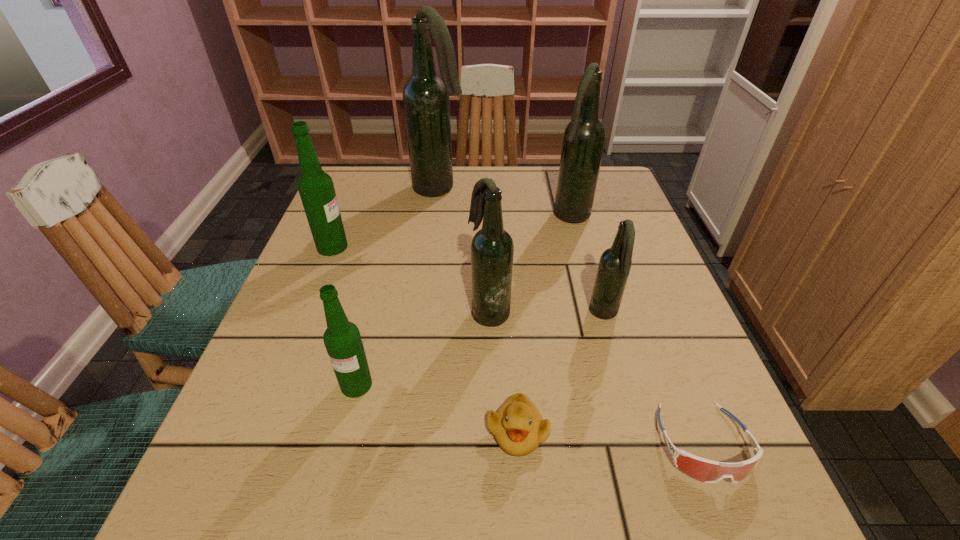
The image size is (960, 540). What are the coordinates of `the tallest beer bottle` in the screenshot? It's located at (426, 102).

The width and height of the screenshot is (960, 540). In order to click on the tallest object in this screenshot , I will do `click(426, 102)`.

You are a GUI agent. You are given a task and a screenshot of the screen. Output one action in this format:
    pyautogui.click(x=<x>, y=<y>)
    Task: Click on the second farthest beer bottle
    The width and height of the screenshot is (960, 540).
    Given the screenshot: What is the action you would take?
    pyautogui.click(x=584, y=137)

Find the location of `the fifth shortest beer bottle`. the fifth shortest beer bottle is located at coordinates (584, 137).

Identify the location of the fourth nearest beer bottle. The height and width of the screenshot is (540, 960). (316, 188).

This screenshot has width=960, height=540. Find the location of `the leftmost beer bottle`. the leftmost beer bottle is located at coordinates (316, 188).

This screenshot has height=540, width=960. Find the location of `the third beer bottle from right to left`. the third beer bottle from right to left is located at coordinates (492, 249).

Find the location of a particular element. the second dark beer bottle from left to right is located at coordinates (492, 249).

I want to click on the smallest dark beer bottle, so click(x=615, y=263).

This screenshot has width=960, height=540. What are the coordinates of `the nearest beer bottle` in the screenshot? It's located at (342, 339).